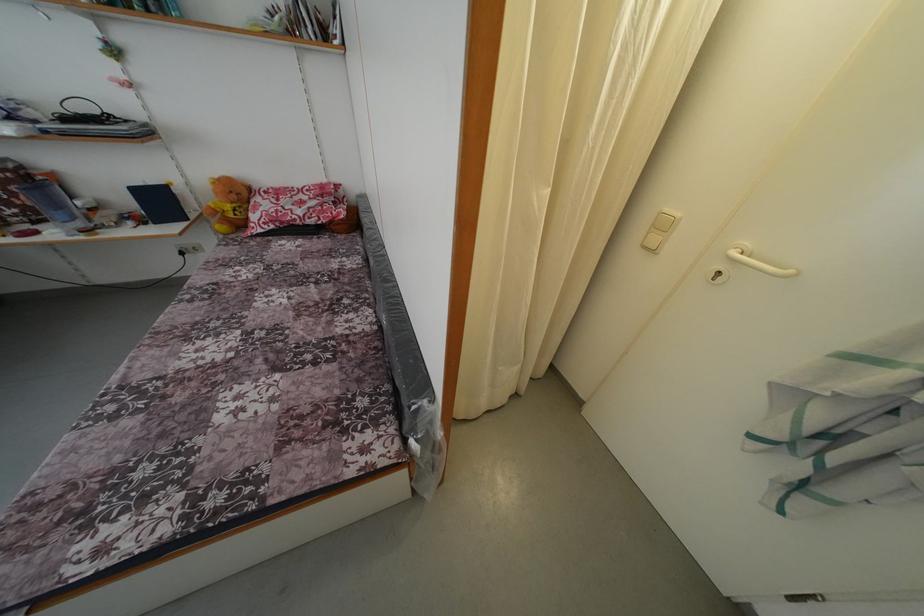
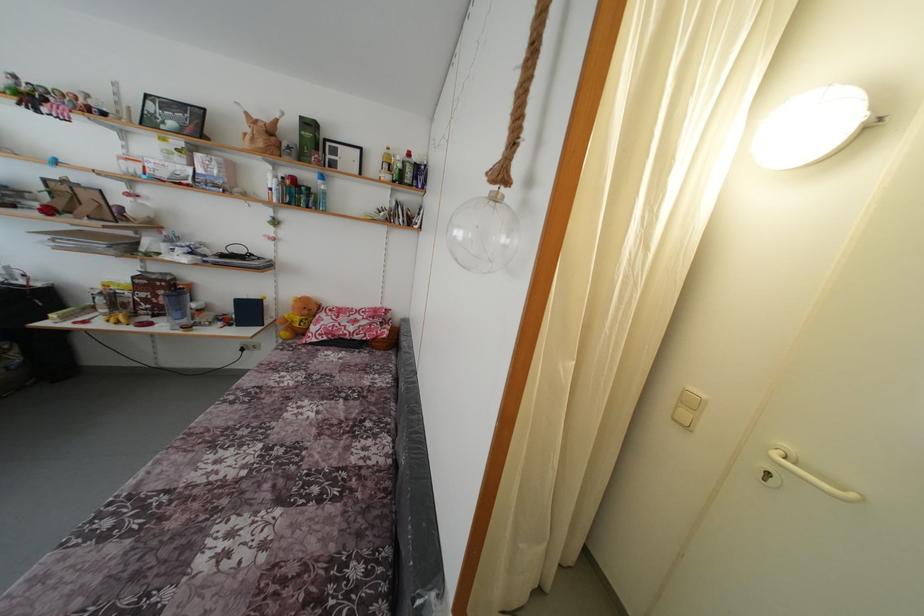
Find the pixel in the second image that matches pixel 796 277 in the first image.

(859, 501)